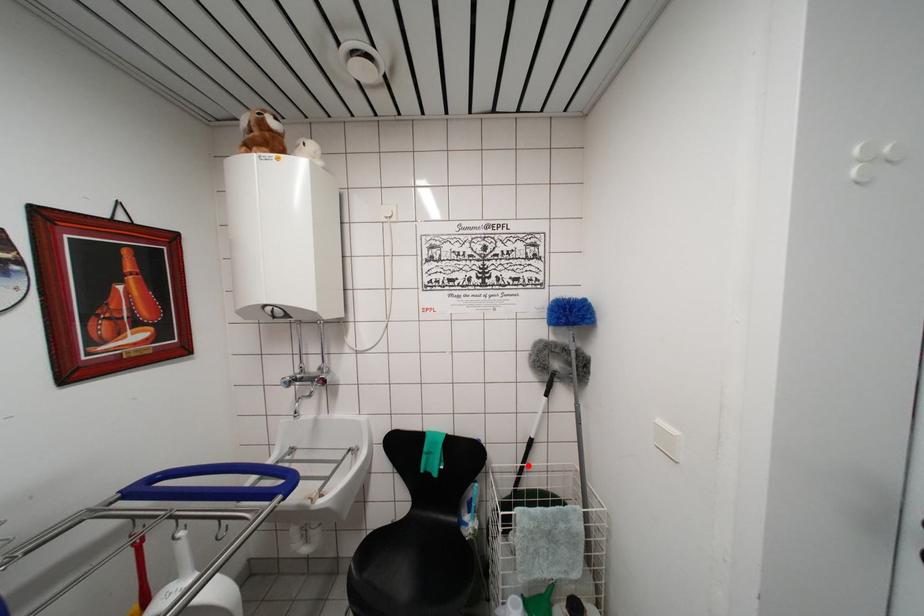
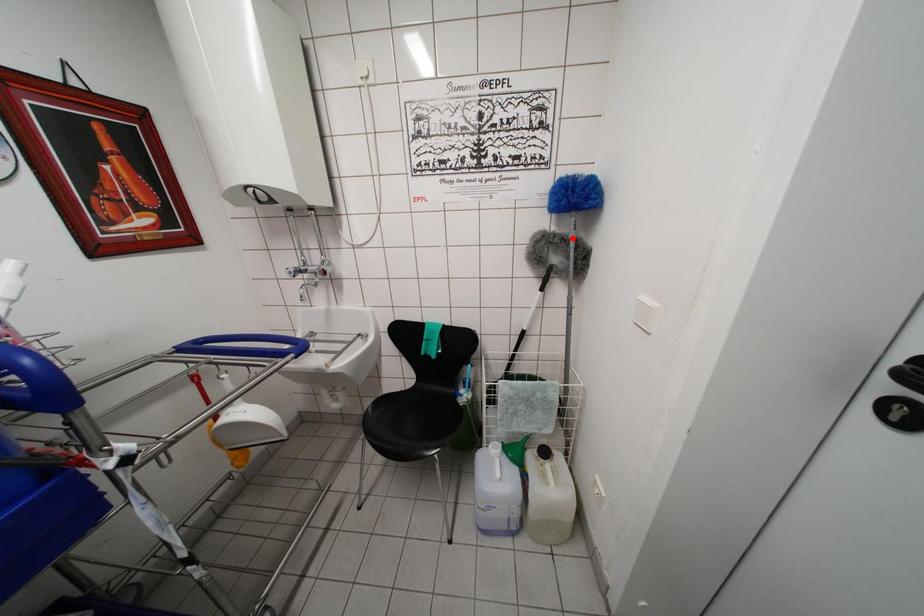
I am providing you with two images of the same scene from different viewpoints. A red point is marked on the first image and another point is marked on the second image. Do the highlighted points in image1 and image2 indicate the same real-world spot?

No